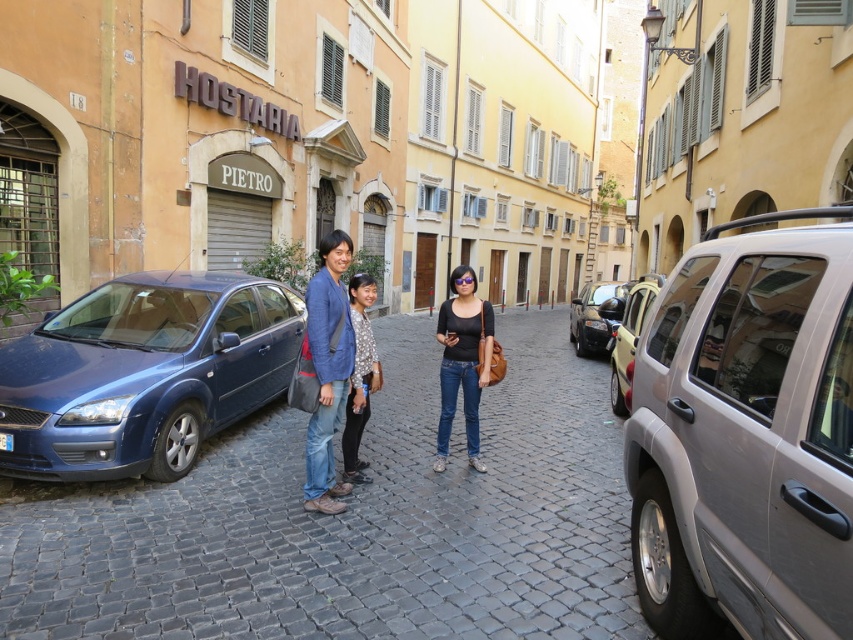
You are a photographer trying to capture a photo of the patterned fabric blouse at center and the shiny black car at center. Which object should you zoom in on to ensure both are in focus?

The patterned fabric blouse at center is smaller than the shiny black car at center, so you should zoom in on the shiny black car at center to ensure both are in focus.

Based on the photo, you are standing in the middle of the cobblestone street and want to check if you can safely walk to the metallic blue car at left without stepping onto the road. The road has a width of 10 feet. Can you reach the car without crossing the road?

The metallic blue car at left is 9.64 feet away from the viewer. Since the road is 10 feet wide, you can safely walk to the metallic blue car at left without stepping onto the road because the distance to the car is less than the road width.

From the picture: You are a tour guide leading a group down the narrow cobblestone street. You notice the silver metallic minivan at right and the metallic silver car at center right parked along the street. Which vehicle is wider?

The metallic silver car at center right is wider than the silver metallic minivan at right.